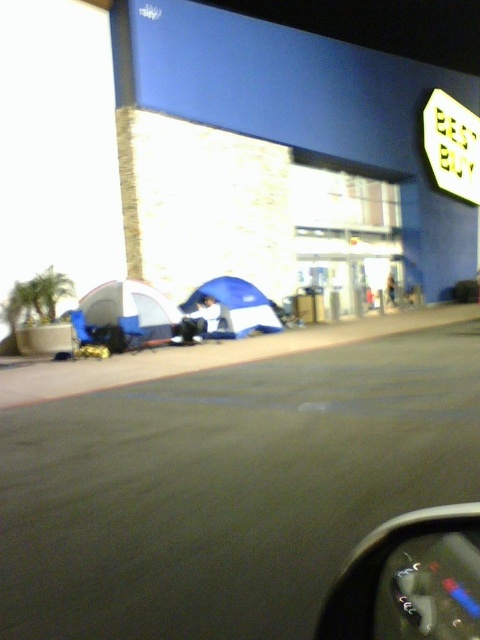
Which is above, yellow plastic sign at upper right or blue fabric tent at lower left?

Positioned higher is yellow plastic sign at upper right.

The height and width of the screenshot is (640, 480). I want to click on yellow plastic sign at upper right, so click(452, 145).

Is metallic gray dashboard at lower center positioned behind blue fabric tent at lower left?

No, metallic gray dashboard at lower center is closer to the viewer.

Can you confirm if metallic gray dashboard at lower center is taller than blue fabric tent at lower left?

No, metallic gray dashboard at lower center is not taller than blue fabric tent at lower left.

Is point (475, 627) positioned behind point (117, 282)?

No, it is in front of (117, 282).

Locate an element on the screen. The image size is (480, 640). metallic gray dashboard at lower center is located at coordinates (409, 579).

Is metallic gray dashboard at lower center above blue fabric tent at center?

No, metallic gray dashboard at lower center is not above blue fabric tent at center.

Image resolution: width=480 pixels, height=640 pixels. Identify the location of metallic gray dashboard at lower center. (409, 579).

Identify the location of metallic gray dashboard at lower center. (409, 579).